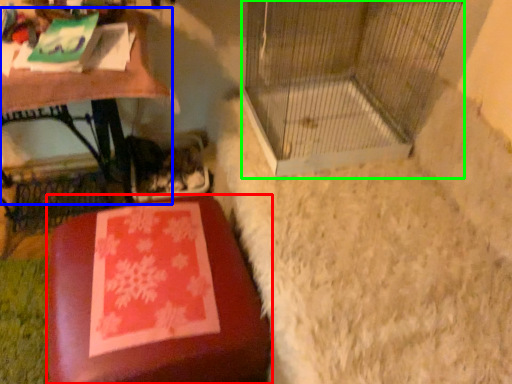
Question: Which object is the farthest from furniture (highlighted by a red box)? Choose among these: table (highlighted by a blue box) or bird cage (highlighted by a green box).

Choices:
 (A) table
 (B) bird cage

Answer: (B)